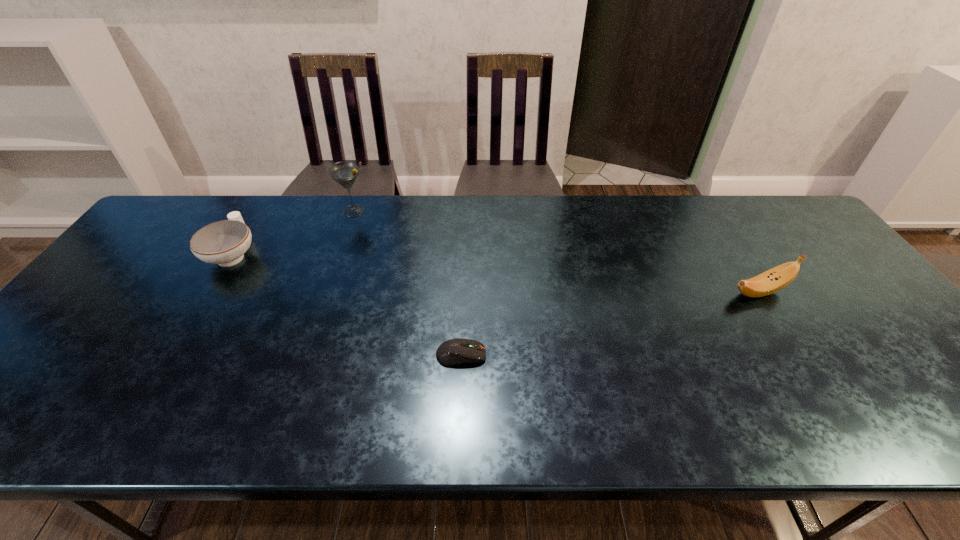
The image size is (960, 540). In order to click on object that is the third nearest to the farthest object in this screenshot , I will do `click(775, 279)`.

Locate an element on the screen. This screenshot has width=960, height=540. vacant space that satisfies the following two spatial constraints: 1. on the side with the handle of the third nearest object; 2. on the right side of the third object from right to left is located at coordinates (259, 211).